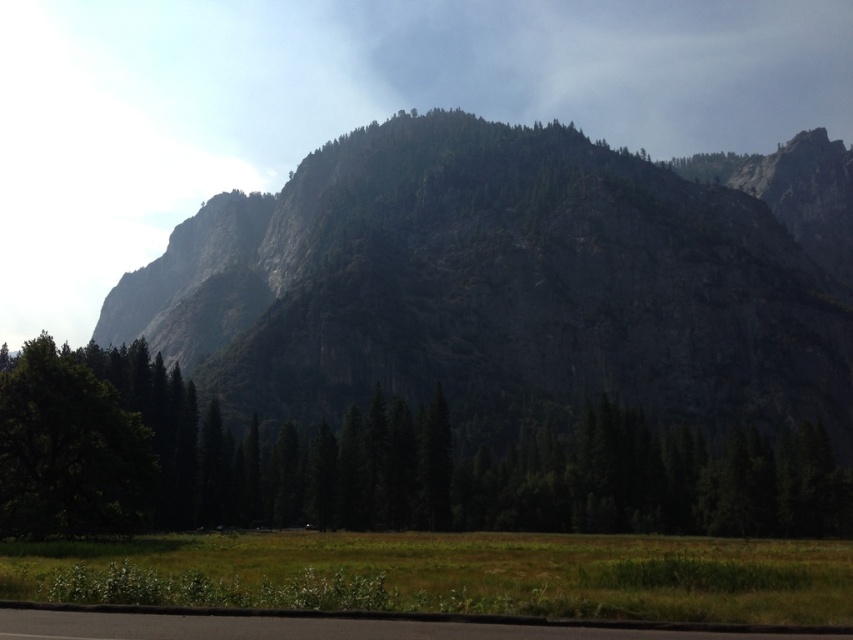
Which is above, transparent white cloud at upper center or green matte tree at center?

transparent white cloud at upper center is above.

Is point (195, 12) closer to camera compared to point (372, 422)?

No, (195, 12) is further to viewer.

The width and height of the screenshot is (853, 640). What are the coordinates of `transparent white cloud at upper center` in the screenshot? It's located at (350, 104).

Can you confirm if green matte tree at center is taller than black asphalt road at lower center?

Yes, green matte tree at center is taller than black asphalt road at lower center.

Who is positioned more to the right, green matte tree at center or black asphalt road at lower center?

Positioned to the right is green matte tree at center.

Does point (576, 445) come closer to viewer compared to point (367, 627)?

No, it is not.

In order to click on green matte tree at center in this screenshot , I will do `click(374, 465)`.

Between point (726, 298) and point (190, 90), which one is positioned in front?

Point (726, 298) is more forward.

Does granite rock formation at center have a larger size compared to transparent white cloud at upper center?

No, granite rock formation at center is not bigger than transparent white cloud at upper center.

This screenshot has height=640, width=853. I want to click on granite rock formation at center, so click(514, 278).

This screenshot has height=640, width=853. I want to click on granite rock formation at center, so click(514, 278).